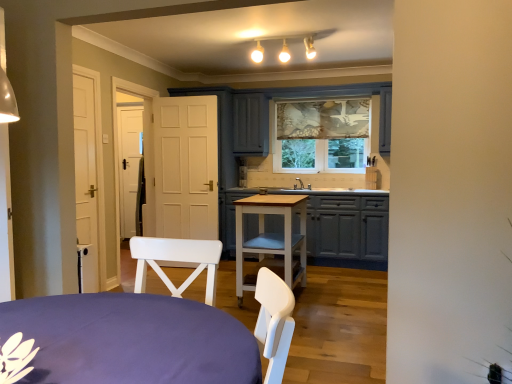
The height and width of the screenshot is (384, 512). What do you see at coordinates (321, 136) in the screenshot?
I see `patterned fabric window at center` at bounding box center [321, 136].

This screenshot has width=512, height=384. What do you see at coordinates (271, 236) in the screenshot?
I see `light brown wooden table at center, the first table positioned from the back` at bounding box center [271, 236].

Locate an element on the screen. The width and height of the screenshot is (512, 384). matte gray cabinets at center is located at coordinates (346, 228).

In the image, is matte gray cabinets at center positioned in front of or behind patterned fabric window at center?

Clearly, matte gray cabinets at center is in front of patterned fabric window at center.

From a real-world perspective, is matte gray cabinets at center positioned over patterned fabric window at center based on gravity?

No.

Does point (336, 204) come farther from viewer compared to point (305, 116)?

No, (336, 204) is in front of (305, 116).

Which of these two, matte gray cabinets at center or patterned fabric window at center, is smaller?

With smaller size is patterned fabric window at center.

From a real-world perspective, is purple fabric-covered table at lower left, which is the 2th table from back to front, positioned above or below patterned fabric window at center?

Clearly, from a real-world perspective, purple fabric-covered table at lower left, which is the 2th table from back to front, is below patterned fabric window at center.

Could you tell me if purple fabric-covered table at lower left, marked as the 1th table in a front-to-back arrangement, is turned towards patterned fabric window at center?

Yes.

Considering the relative positions of purple fabric-covered table at lower left, marked as the 1th table in a front-to-back arrangement, and patterned fabric window at center in the image provided, is purple fabric-covered table at lower left, marked as the 1th table in a front-to-back arrangement, behind patterned fabric window at center?

No.

Is purple fabric-covered table at lower left, which is the 2th table from back to front, not near patterned fabric window at center?

Yes, purple fabric-covered table at lower left, which is the 2th table from back to front, and patterned fabric window at center are quite far apart.

Is purple fabric-covered table at lower left, which is the 2th table from back to front, aimed at matte gray cabinets at center?

Yes, purple fabric-covered table at lower left, which is the 2th table from back to front, is oriented towards matte gray cabinets at center.

From the picture: Are purple fabric-covered table at lower left, which is the 2th table from back to front, and matte gray cabinets at center far apart?

Indeed, purple fabric-covered table at lower left, which is the 2th table from back to front, is not near matte gray cabinets at center.

From a real-world perspective, is purple fabric-covered table at lower left, marked as the 1th table in a front-to-back arrangement, above or below matte gray cabinets at center?

purple fabric-covered table at lower left, marked as the 1th table in a front-to-back arrangement, is above matte gray cabinets at center.

Can you confirm if purple fabric-covered table at lower left, which is the 2th table from back to front, is shorter than matte gray cabinets at center?

Yes.

In order to click on cabinetry beneath the purple fabric-covered table at lower left, which is the 2th table from back to front (from a real-world perspective) in this screenshot , I will do `click(346, 228)`.

Is matte gray cabinets at center completely or partially outside of purple fabric-covered table at lower left, marked as the 1th table in a front-to-back arrangement?

matte gray cabinets at center lies outside purple fabric-covered table at lower left, marked as the 1th table in a front-to-back arrangement,'s area.

From a real-world perspective, is matte gray cabinets at center beneath purple fabric-covered table at lower left, which is the 2th table from back to front?

Yes, from a real-world perspective, matte gray cabinets at center is beneath purple fabric-covered table at lower left, which is the 2th table from back to front.

Can you confirm if light brown wooden table at center, the first table positioned from the back, is smaller than patterned fabric window at center?

No.

Does point (285, 203) appear closer or farther from the camera than point (305, 135)?

Point (285, 203) appears to be closer to the viewer than point (305, 135).

From the image's perspective, which one is positioned higher, patterned fabric window at center or light brown wooden table at center, the first table positioned from the back?

patterned fabric window at center appears higher in the image.

From a real-world perspective, is patterned fabric window at center positioned under light brown wooden table at center, the first table positioned from the back, based on gravity?

No.

Is patterned fabric window at center not near light brown wooden table at center, arranged as the 2th table when viewed from the front?

Yes.

Is matte gray cabinets at center positioned in front of light brown wooden table at center, the first table positioned from the back?

No, matte gray cabinets at center is behind light brown wooden table at center, the first table positioned from the back.

Does point (275, 222) appear closer or farther from the camera than point (242, 263)?

Clearly, point (275, 222) is more distant from the camera than point (242, 263).

Looking at this image, can we say matte gray cabinets at center lies outside light brown wooden table at center, the first table positioned from the back?

Yes, matte gray cabinets at center is not within light brown wooden table at center, the first table positioned from the back.

I want to click on cabinetry in front of the patterned fabric window at center, so click(x=346, y=228).

You are a GUI agent. You are given a task and a screenshot of the screen. Output one action in this format:
    pyautogui.click(x=<x>, y=<y>)
    Task: Click on the window that is above the purple fabric-covered table at lower left, which is the 2th table from back to front (from the image's perspective)
    Image resolution: width=512 pixels, height=384 pixels.
    Given the screenshot: What is the action you would take?
    pyautogui.click(x=321, y=136)

When comparing their distances from patterned fabric window at center, does light brown wooden table at center, the first table positioned from the back, or purple fabric-covered table at lower left, which is the 2th table from back to front, seem closer?

Among the two, light brown wooden table at center, the first table positioned from the back, is located nearer to patterned fabric window at center.

When comparing their distances from patterned fabric window at center, does matte gray cabinets at center or purple fabric-covered table at lower left, which is the 2th table from back to front, seem further?

purple fabric-covered table at lower left, which is the 2th table from back to front, is positioned further to the anchor patterned fabric window at center.

Estimate the real-world distances between objects in this image. Which object is further from light brown wooden table at center, arranged as the 2th table when viewed from the front, purple fabric-covered table at lower left, marked as the 1th table in a front-to-back arrangement, or matte gray cabinets at center?

The object further to light brown wooden table at center, arranged as the 2th table when viewed from the front, is purple fabric-covered table at lower left, marked as the 1th table in a front-to-back arrangement.

Looking at the image, which one is located further to matte gray cabinets at center, light brown wooden table at center, the first table positioned from the back, or purple fabric-covered table at lower left, which is the 2th table from back to front?

The object further to matte gray cabinets at center is purple fabric-covered table at lower left, which is the 2th table from back to front.

From the image, which object appears to be farther from matte gray cabinets at center, purple fabric-covered table at lower left, marked as the 1th table in a front-to-back arrangement, or patterned fabric window at center?

purple fabric-covered table at lower left, marked as the 1th table in a front-to-back arrangement, lies further to matte gray cabinets at center than the other object.

Looking at the image, which one is located closer to patterned fabric window at center, matte gray cabinets at center or light brown wooden table at center, the first table positioned from the back?

matte gray cabinets at center is positioned closer to the anchor patterned fabric window at center.

Estimate the real-world distances between objects in this image. Which object is further from purple fabric-covered table at lower left, which is the 2th table from back to front, patterned fabric window at center or matte gray cabinets at center?

patterned fabric window at center.

From the image, which object appears to be nearer to light brown wooden table at center, the first table positioned from the back, purple fabric-covered table at lower left, marked as the 1th table in a front-to-back arrangement, or patterned fabric window at center?

patterned fabric window at center lies closer to light brown wooden table at center, the first table positioned from the back, than the other object.

At what (x,y) coordinates should I click in order to perform the action: click on cabinetry located between light brown wooden table at center, arranged as the 2th table when viewed from the front, and patterned fabric window at center in the depth direction. Please return your answer as a coordinate pair (x, y). The image size is (512, 384). Looking at the image, I should click on (346, 228).

Image resolution: width=512 pixels, height=384 pixels. I want to click on table between purple fabric-covered table at lower left, which is the 2th table from back to front, and patterned fabric window at center in the front-back direction, so click(271, 236).

Identify the location of cabinetry between purple fabric-covered table at lower left, marked as the 1th table in a front-to-back arrangement, and patterned fabric window at center, along the z-axis. The width and height of the screenshot is (512, 384). (346, 228).

The width and height of the screenshot is (512, 384). Find the location of `table between purple fabric-covered table at lower left, which is the 2th table from back to front, and matte gray cabinets at center in the front-back direction`. table between purple fabric-covered table at lower left, which is the 2th table from back to front, and matte gray cabinets at center in the front-back direction is located at coordinates (271, 236).